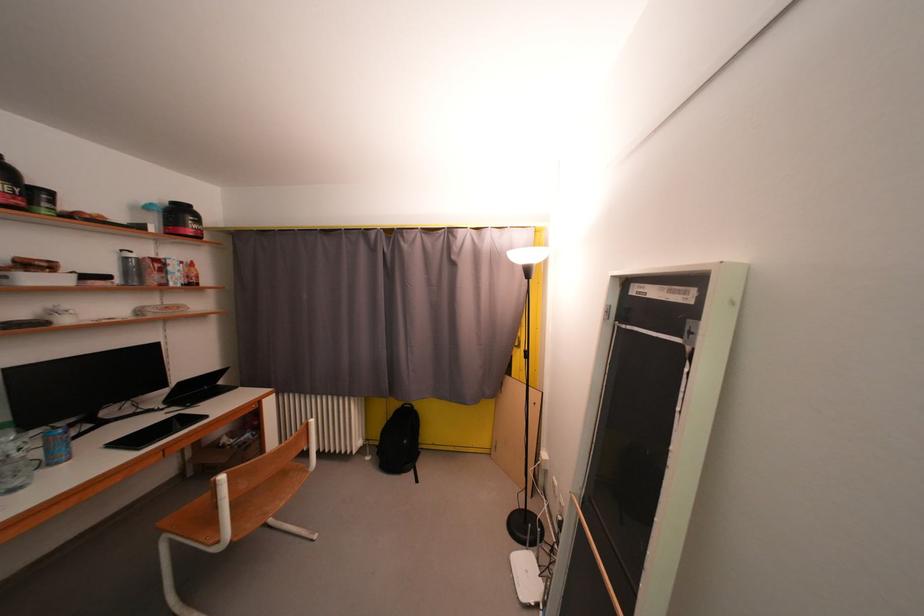
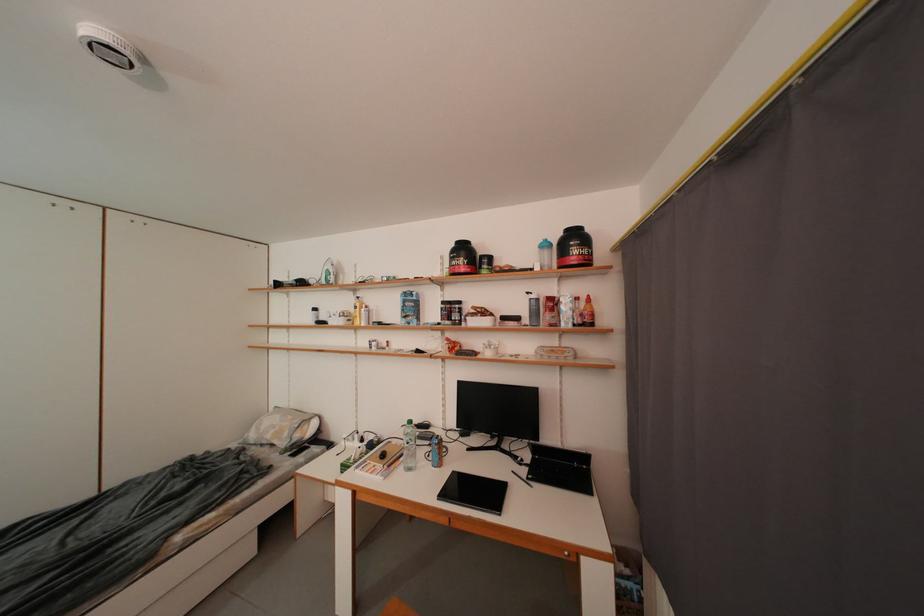
Where in the second image is the point corresponding to the point at 155,211 from the first image?

(553, 249)